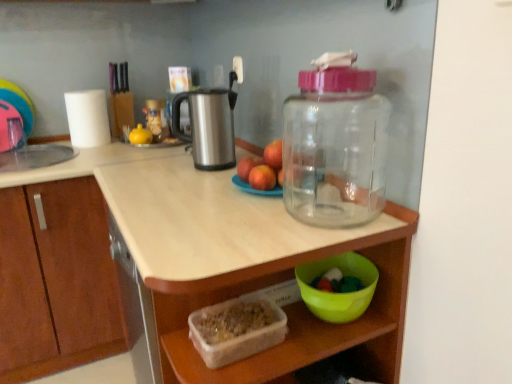
This screenshot has width=512, height=384. I want to click on free area below transparent plastic bottle at upper right (from a real-world perspective), so click(335, 210).